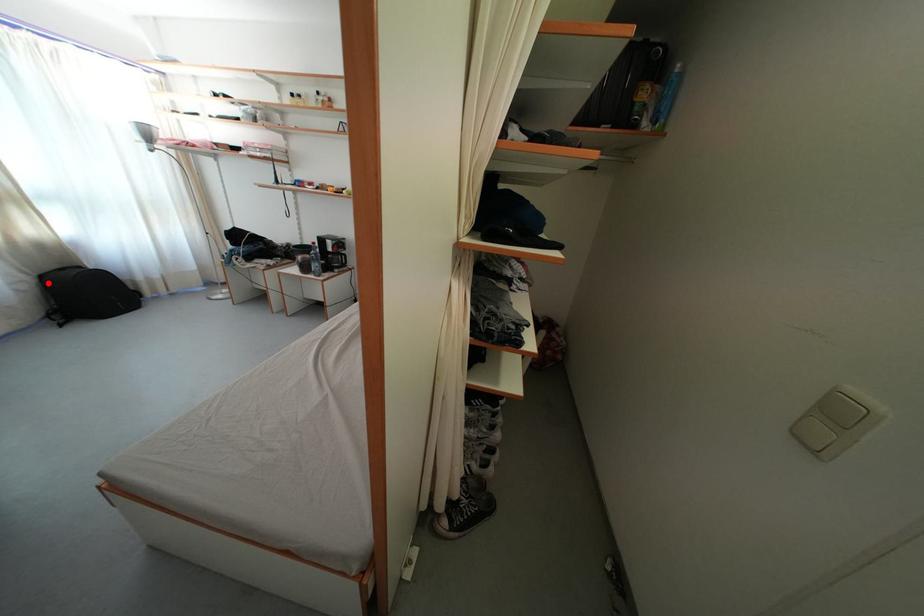
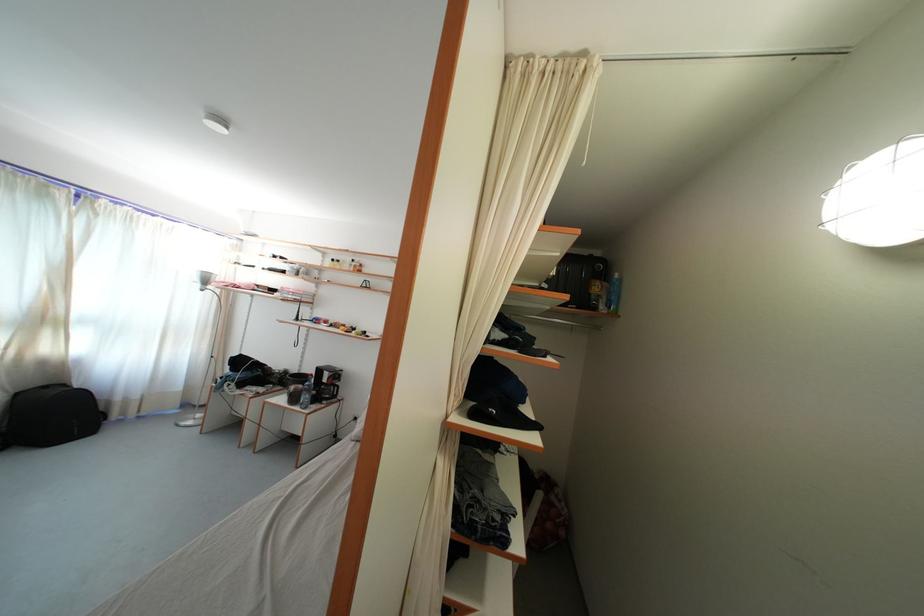
The point at the highlighted location is marked in the first image. Where is the corresponding point in the second image?

(23, 400)